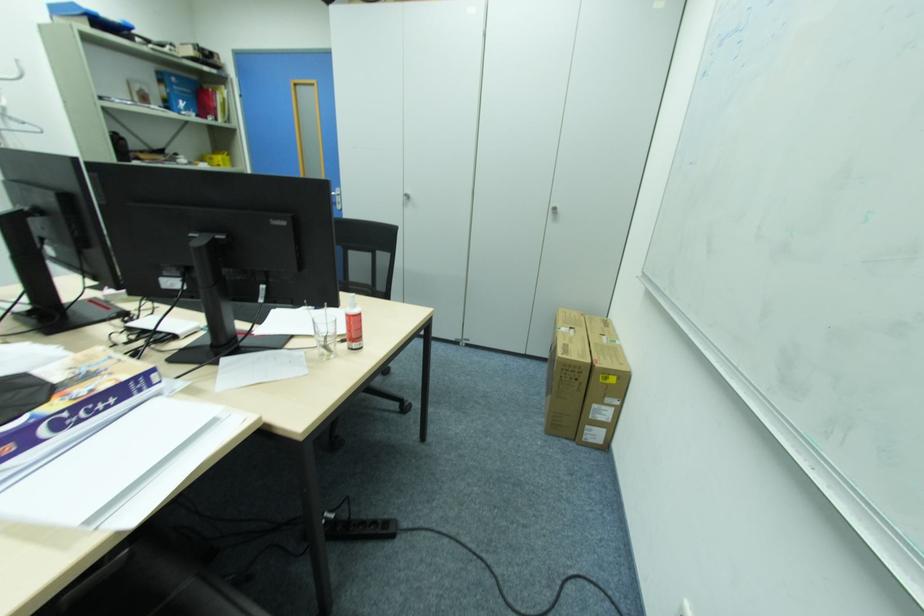
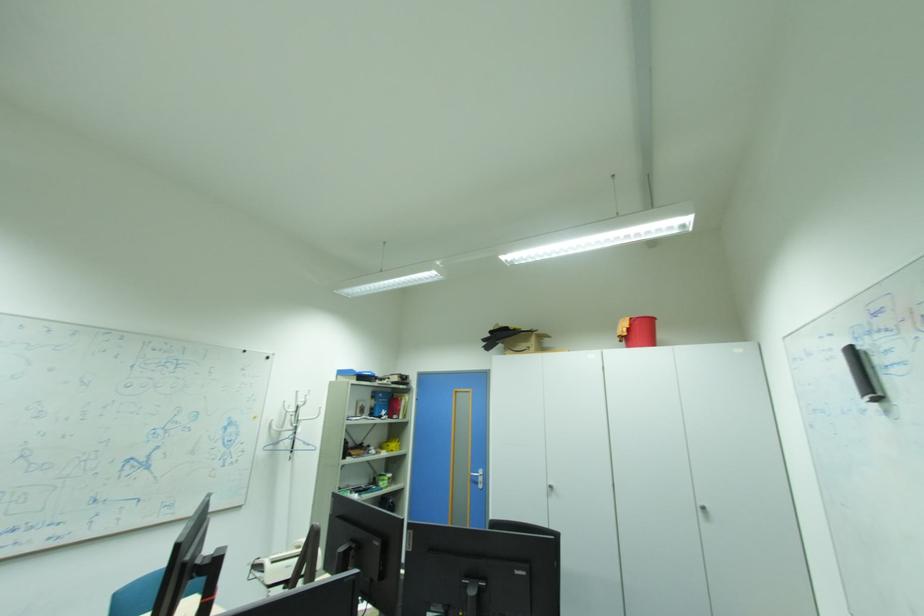
The first image is from the beginning of the video and the second image is from the end. How did the camera likely rotate when shooting the video?

The rotation direction of the camera is left-up.